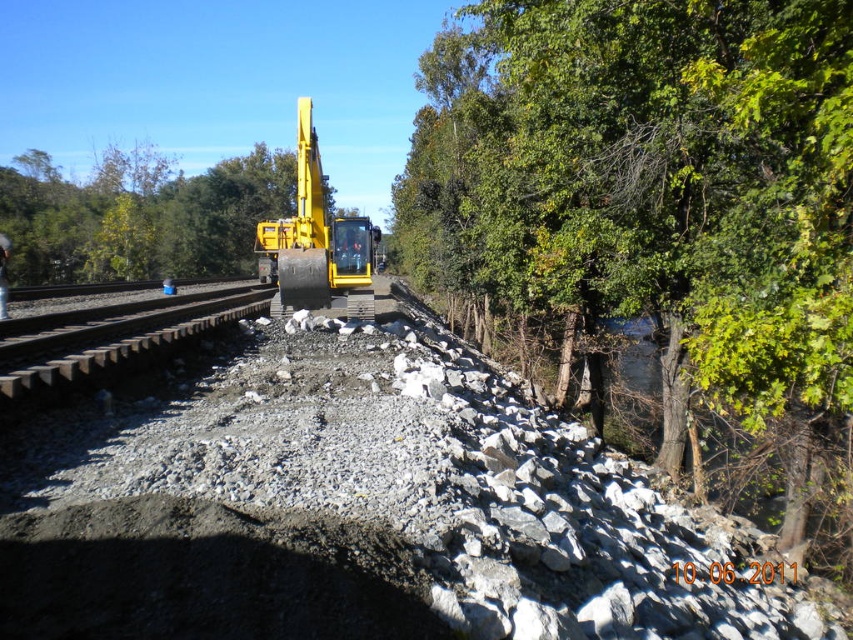
Question: Does gray gravel train track at left appear under yellow metallic excavator at center?

Choices:
 (A) no
 (B) yes

Answer: (B)

Question: Estimate the real-world distances between objects in this image. Which object is farther from the green leafy tree at center?

Choices:
 (A) yellow metallic excavator at center
 (B) green leafy tree at upper right
 (C) gray gravel train track at left

Answer: (C)

Question: Which point is closer to the camera?

Choices:
 (A) green leafy tree at center
 (B) green leafy tree at upper right
 (C) gray gravel train track at left

Answer: (B)

Question: Is green leafy tree at center closer to camera compared to gray gravel train track at left?

Choices:
 (A) yes
 (B) no

Answer: (B)

Question: Is gray gravel train track at left smaller than yellow metallic excavator at center?

Choices:
 (A) no
 (B) yes

Answer: (B)

Question: Which object is positioned closest to the green leafy tree at upper right?

Choices:
 (A) gray gravel train track at left
 (B) green leafy tree at center

Answer: (A)